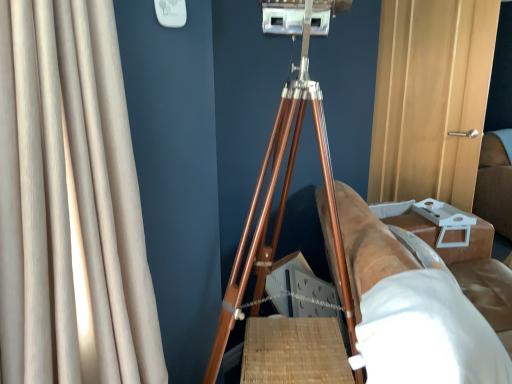
Question: Is white matte sheet at lower right at the right side of brown leather couch at right?

Choices:
 (A) no
 (B) yes

Answer: (A)

Question: From a real-world perspective, is white matte sheet at lower right on top of brown leather couch at right?

Choices:
 (A) no
 (B) yes

Answer: (B)

Question: Can you confirm if white matte sheet at lower right is thinner than brown leather couch at right?

Choices:
 (A) yes
 (B) no

Answer: (A)

Question: Can you confirm if white matte sheet at lower right is wider than brown leather couch at right?

Choices:
 (A) yes
 (B) no

Answer: (B)

Question: Is white matte sheet at lower right next to brown leather couch at right?

Choices:
 (A) yes
 (B) no

Answer: (A)

Question: Is white matte sheet at lower right further to the viewer compared to brown leather couch at right?

Choices:
 (A) no
 (B) yes

Answer: (A)

Question: Can you confirm if wooden tripod at center is positioned to the left of white matte sheet at lower right?

Choices:
 (A) yes
 (B) no

Answer: (A)

Question: Is wooden tripod at center closer to the viewer compared to white matte sheet at lower right?

Choices:
 (A) no
 (B) yes

Answer: (A)

Question: Can we say wooden tripod at center lies outside white matte sheet at lower right?

Choices:
 (A) no
 (B) yes

Answer: (B)

Question: Is wooden tripod at center next to white matte sheet at lower right and touching it?

Choices:
 (A) no
 (B) yes

Answer: (A)

Question: Is wooden tripod at center at the right side of white matte sheet at lower right?

Choices:
 (A) yes
 (B) no

Answer: (B)

Question: Does wooden tripod at center have a greater height compared to white matte sheet at lower right?

Choices:
 (A) no
 (B) yes

Answer: (B)

Question: From the image's perspective, is wooden tripod at center beneath beige fabric curtain at left?

Choices:
 (A) no
 (B) yes

Answer: (B)